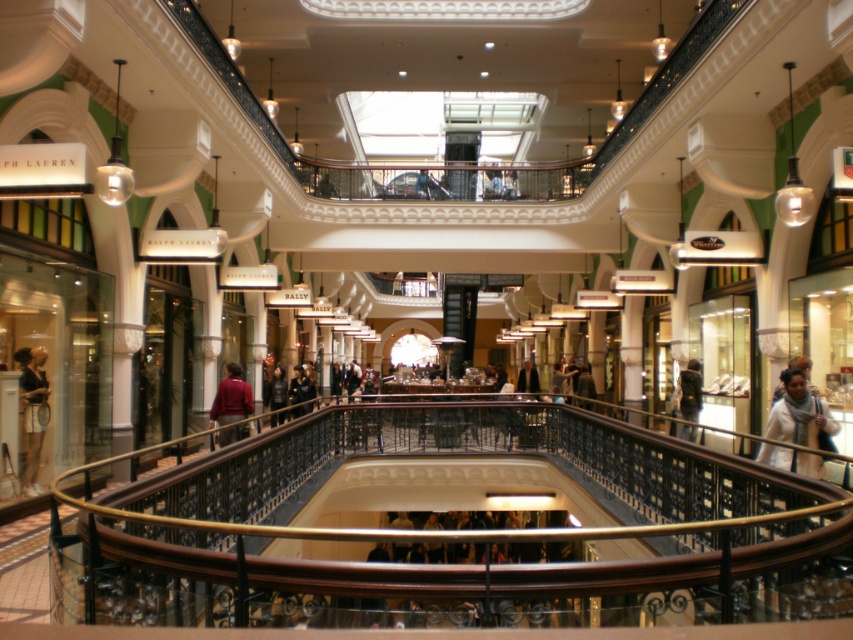
Based on the photo, you are a customer in the mall and want to pick up both the white fabric bag at lower right and the matte black dress at lower left. Which item do you need to move closer to first to access the other?

You need to move closer to the white fabric bag at lower right first because it is in front of the matte black dress at lower left, so moving it will allow access to the dress behind.

You are a delivery person carrying a package that is 3 meters long. You need to move from the wooden at center to the dark gray fabric at center. Can you move the package horizontally without tilting it?

The wooden at center is 3.24 meters away from the dark gray fabric at center. Since the package is 3 meters long, which is shorter than the distance between them, you can move the package horizontally without tilting it.